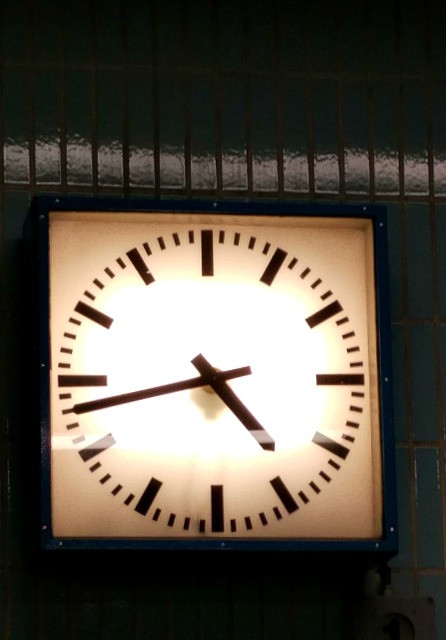
In order to click on outlet in this screenshot , I will do `click(410, 607)`.